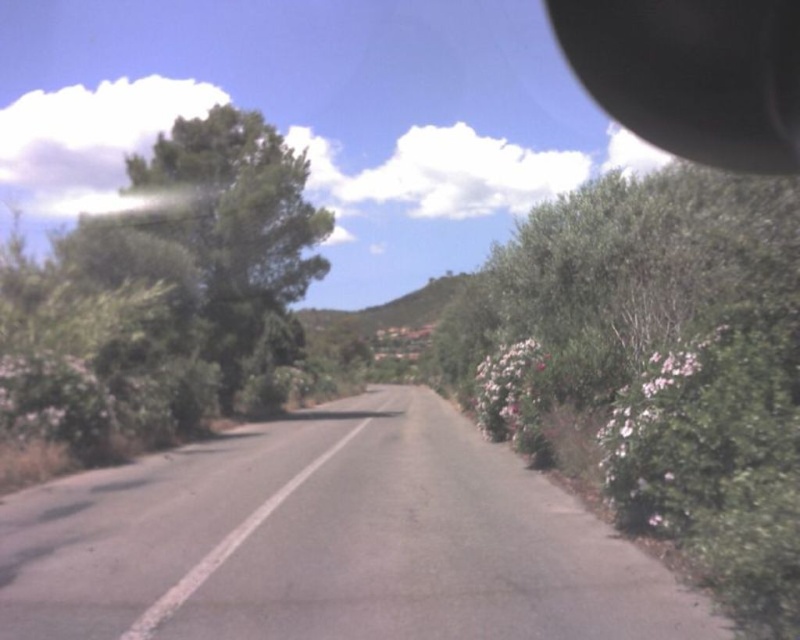
Is green leafy bush at right wider than pink fluffy bush at right?

Indeed, green leafy bush at right has a greater width compared to pink fluffy bush at right.

Can you confirm if green leafy bush at right is positioned above pink fluffy bush at right?

Correct, green leafy bush at right is located above pink fluffy bush at right.

The height and width of the screenshot is (640, 800). I want to click on green leafy bush at right, so click(x=660, y=364).

Looking at this image, who is more forward, (706,138) or (492,412)?

Positioned in front is point (706,138).

Is point (733, 38) in front of point (505, 388)?

No, (733, 38) is behind (505, 388).

In order to click on black rubber view mirror at upper right in this screenshot , I will do `click(692, 74)`.

Is white matte flowers at right smaller than pink fluffy bush at right?

Yes, white matte flowers at right is smaller than pink fluffy bush at right.

Describe the element at coordinates (662, 417) in the screenshot. I see `white matte flowers at right` at that location.

Who is more distant from viewer, (686, 451) or (482, 396)?

The point (482, 396) is more distant.

I want to click on white matte flowers at right, so click(x=662, y=417).